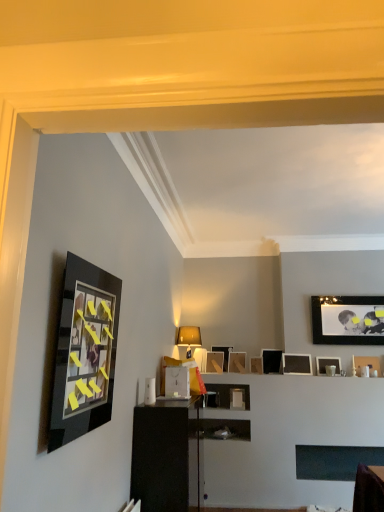
Question: Relative to matte white table lamp at center, is wooden picture frame at center, the third picture frame when ordered from left to right, in front or behind?

Choices:
 (A) behind
 (B) front

Answer: (A)

Question: Is wooden picture frame at center, the 1th picture frame when ordered from back to front, taller or shorter than matte white table lamp at center?

Choices:
 (A) tall
 (B) short

Answer: (B)

Question: Which object is the closest to the matte black picture frame at upper right, which ranks as the 10th picture frame in left-to-right order?

Choices:
 (A) matte black picture frame at upper right, which ranks as the 5th picture frame in front-to-back order
 (B) matte black picture frame at center, the 7th picture frame positioned from the front
 (C) wooden picture frame at center, which is the third picture frame from front to back
 (D) wooden picture frame at center, the 1th picture frame when ordered from back to front
 (E) matte black picture frame at upper right, which ranks as the 7th picture frame in left-to-right order

Answer: (A)

Question: Based on their relative distances, which object is farther from the black glossy dresser at center?

Choices:
 (A) matte black picture frame at upper right, which is the 6th picture frame from back to front
 (B) matte black picture frame at upper right, acting as the ninth picture frame starting from the back
 (C) matte black picture frame at center, which is the 2th picture frame in back-to-front order
 (D) wooden picture frame at center, which is the third picture frame from front to back
 (E) matte white table lamp at center

Answer: (B)